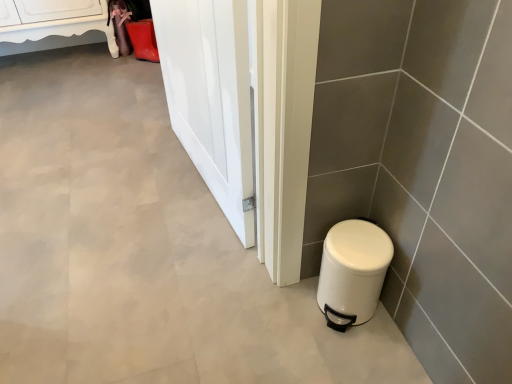
Where is `vacant space in front of white glossy door at center`? Image resolution: width=512 pixels, height=384 pixels. vacant space in front of white glossy door at center is located at coordinates (161, 233).